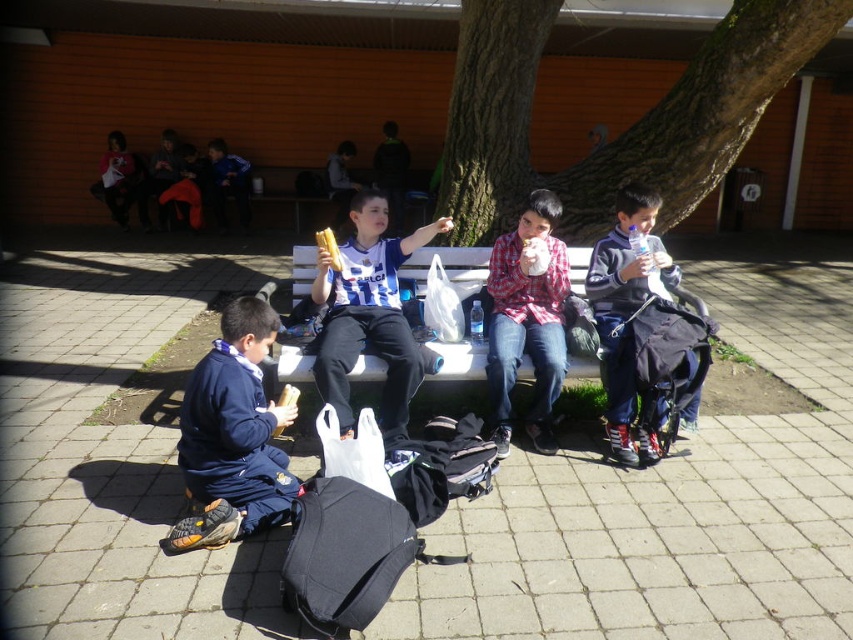
Question: Is matte blue and white jersey at center positioned before matte gray jacket at right?

Choices:
 (A) no
 (B) yes

Answer: (B)

Question: Does green rough bark tree at center appear over white plastic bench at center?

Choices:
 (A) yes
 (B) no

Answer: (A)

Question: Among these objects, which one is nearest to the camera?

Choices:
 (A) matte blue and white jersey at center
 (B) matte gray jacket at right
 (C) plaid cotton shirt at center
 (D) green rough bark tree at center

Answer: (A)

Question: Can you confirm if plaid cotton shirt at center is bigger than white plastic bench at center?

Choices:
 (A) yes
 (B) no

Answer: (B)

Question: Which point is closer to the camera?

Choices:
 (A) plaid cotton shirt at center
 (B) white plastic bench at center

Answer: (A)

Question: Estimate the real-world distances between objects in this image. Which object is farther from the matte blue and white jersey at center?

Choices:
 (A) white plastic bench at center
 (B) green rough bark tree at center
 (C) plaid cotton shirt at center

Answer: (B)